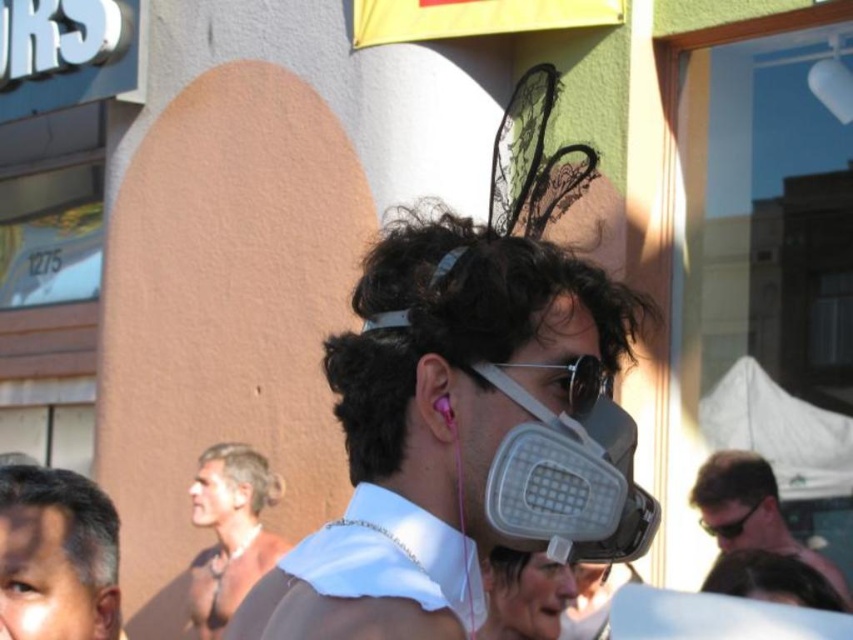
Question: Does gray matte respirator at center have a greater width compared to matte gray respirator at center?

Choices:
 (A) no
 (B) yes

Answer: (B)

Question: Which point is closer to the camera?

Choices:
 (A) gray matte gas mask at center
 (B) gray matte goggles at center
 (C) dark brown curly hair at upper center
 (D) light brown hair at center

Answer: (A)

Question: Does gray matte gas mask at center appear under gray matte hair at center?

Choices:
 (A) yes
 (B) no

Answer: (B)

Question: Is gray matte gas mask at center behind gray matte hair at center?

Choices:
 (A) yes
 (B) no

Answer: (B)

Question: Which object is closer to the camera taking this photo?

Choices:
 (A) gray matte respirator at center
 (B) light brown hair at center
 (C) gray matte mask at lower left
 (D) matte gray respirator at center

Answer: (A)

Question: Which point is closer to the camera taking this photo?

Choices:
 (A) (749, 515)
 (B) (262, 476)

Answer: (A)